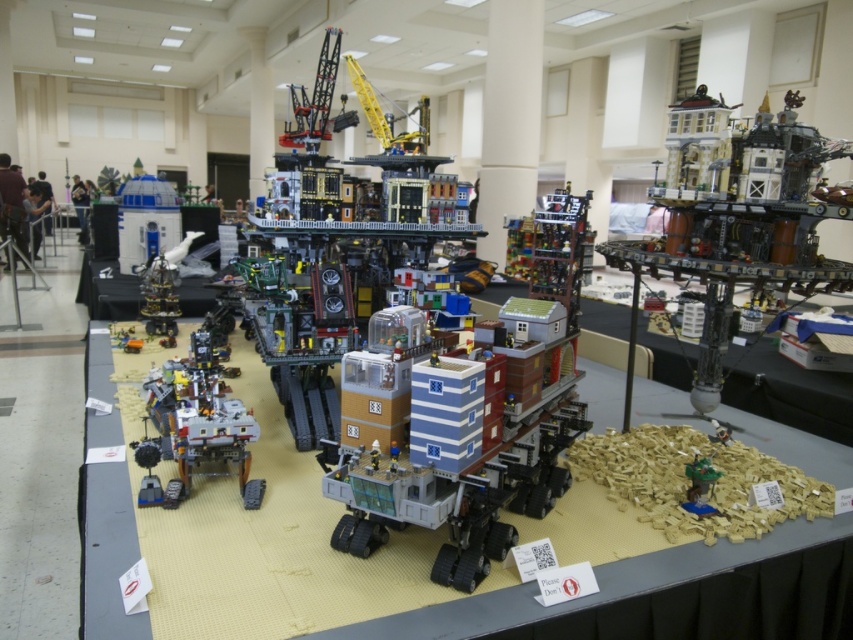
You are standing at the entrance of the exhibition hall and see the point marked at coordinate (x=466, y=449). What object is located at that point?

The point at coordinate (x=466, y=449) is located on the matte plastic rover at center.

Consider the image. You are standing in the exhibition space and want to determine which of the two points, point (x=149, y=408) or point (x=161, y=323), is closer to you. Based on the LEGO model display, which point is nearer?

Point (x=149, y=408) is closer to the viewer than point (x=161, y=323).